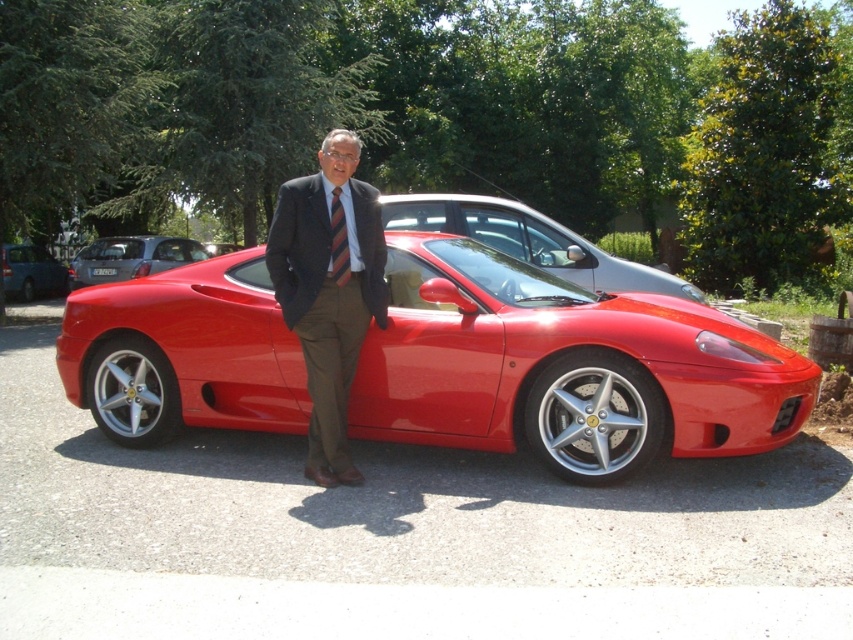
Question: In this image, where is glossy metallic hatchback at center located relative to striped fabric tie at center?

Choices:
 (A) above
 (B) below

Answer: (A)

Question: Among these objects, which one is farthest from the camera?

Choices:
 (A) matte blue van at left
 (B) shiny red sports car at center
 (C) matte black suit at center

Answer: (A)

Question: Which of these objects is positioned farthest from the striped fabric tie at center?

Choices:
 (A) glossy red sports car at center
 (B) shiny red sports car at center
 (C) matte black suit at center
 (D) glossy metallic hatchback at center

Answer: (D)

Question: Is matte black suit at center thinner than striped fabric tie at center?

Choices:
 (A) yes
 (B) no

Answer: (B)

Question: Is matte black suit at center to the left of matte blue van at left from the viewer's perspective?

Choices:
 (A) yes
 (B) no

Answer: (B)

Question: Which point is closer to the camera?

Choices:
 (A) matte black suit at center
 (B) glossy metallic hatchback at center
 (C) matte blue van at left

Answer: (A)